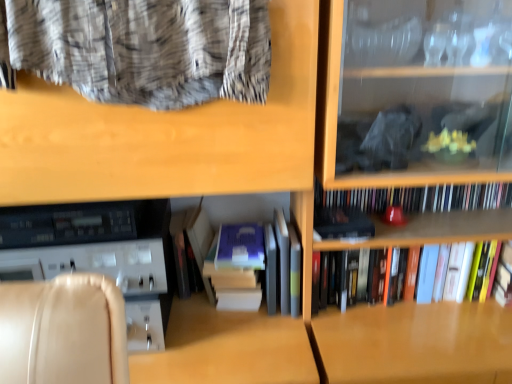
Question: Which direction should I rotate to look at hardcover books at center, which is the third book from top to bottom?

Choices:
 (A) right
 (B) left

Answer: (A)

Question: Can you confirm if blue matte paperback book at center, the first paperback book in the left-to-right sequence, is positioned to the left of matte black book at center, marked as the first paperback book in a right-to-left arrangement?

Choices:
 (A) yes
 (B) no

Answer: (A)

Question: Does blue matte paperback book at center, the first paperback book in the left-to-right sequence, have a lesser width compared to matte black book at center, marked as the first paperback book in a right-to-left arrangement?

Choices:
 (A) no
 (B) yes

Answer: (A)

Question: Is blue matte paperback book at center, the first paperback book in the left-to-right sequence, not close to matte black book at center, marked as the first paperback book in a right-to-left arrangement?

Choices:
 (A) yes
 (B) no

Answer: (B)

Question: From the image's perspective, does blue matte paperback book at center, the 2th paperback book when ordered from right to left, appear higher than matte black book at center, marked as the first paperback book in a right-to-left arrangement?

Choices:
 (A) yes
 (B) no

Answer: (B)

Question: Could you tell me if blue matte paperback book at center, the first paperback book in the left-to-right sequence, is facing matte black book at center, the second paperback book viewed from the left?

Choices:
 (A) yes
 (B) no

Answer: (B)

Question: Is blue matte paperback book at center, the 2th paperback book when ordered from right to left, positioned with its back to matte black book at center, marked as the first paperback book in a right-to-left arrangement?

Choices:
 (A) no
 (B) yes

Answer: (A)

Question: From a real-world perspective, is hardcover books at center, the first book positioned from the top, physically above matte black book at center, marked as the first paperback book in a right-to-left arrangement?

Choices:
 (A) no
 (B) yes

Answer: (B)

Question: From the image's perspective, does hardcover books at center, the first book positioned from the top, appear lower than matte black book at center, the second paperback book viewed from the left?

Choices:
 (A) no
 (B) yes

Answer: (A)

Question: From the image's perspective, is hardcover books at center, which appears as the third book when ordered from the bottom, above matte black book at center, marked as the first paperback book in a right-to-left arrangement?

Choices:
 (A) no
 (B) yes

Answer: (B)

Question: Does hardcover books at center, the first book positioned from the top, have a greater height compared to matte black book at center, the second paperback book viewed from the left?

Choices:
 (A) yes
 (B) no

Answer: (A)

Question: Considering the relative sizes of hardcover books at center, the first book positioned from the top, and matte black book at center, the second paperback book viewed from the left, in the image provided, is hardcover books at center, the first book positioned from the top, thinner than matte black book at center, the second paperback book viewed from the left,?

Choices:
 (A) no
 (B) yes

Answer: (B)

Question: From a real-world perspective, is hardcover books at center, which appears as the third book when ordered from the bottom, positioned under matte black book at center, marked as the first paperback book in a right-to-left arrangement, based on gravity?

Choices:
 (A) yes
 (B) no

Answer: (B)

Question: Does matte black book at center, the second paperback book viewed from the left, have a greater height compared to hardcover book at center, arranged as the 2th book when ordered from the bottom?

Choices:
 (A) no
 (B) yes

Answer: (A)